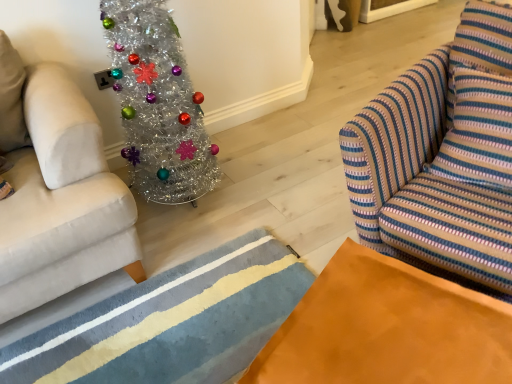
This screenshot has width=512, height=384. I want to click on vacant point above orange suede table at lower right (from a real-world perspective), so click(x=386, y=325).